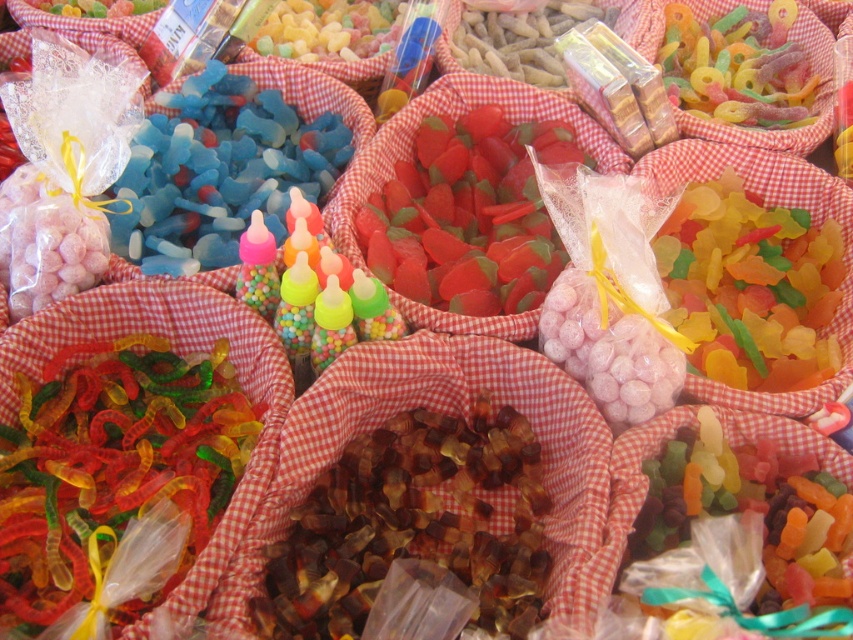
Which is behind, point (271, 605) or point (397, 262)?

The point (397, 262) is behind.

What do you see at coordinates (412, 524) in the screenshot?
I see `translucent amber gummy bears at center` at bounding box center [412, 524].

Locate an element on the screen. The height and width of the screenshot is (640, 853). translucent amber gummy bears at center is located at coordinates (412, 524).

Does translucent red gummy at center have a larger size compared to blue translucent gummy bears at upper left?

No, translucent red gummy at center is not bigger than blue translucent gummy bears at upper left.

Who is more distant from viewer, (403, 260) or (190, 273)?

Point (403, 260)

At what (x,y) coordinates should I click in order to perform the action: click on translucent red gummy at center. Please return your answer as a coordinate pair (x, y). This screenshot has width=853, height=640. Looking at the image, I should click on (468, 216).

Does point (302, 566) come closer to viewer compared to point (230, 99)?

Yes, it is.

Measure the distance from translucent amber gummy bears at center to blue translucent gummy bears at upper left.

translucent amber gummy bears at center and blue translucent gummy bears at upper left are 23.73 inches apart.

Is point (360, 480) positioned before point (225, 161)?

Yes.

Image resolution: width=853 pixels, height=640 pixels. Find the location of `translucent amber gummy bears at center`. translucent amber gummy bears at center is located at coordinates (412, 524).